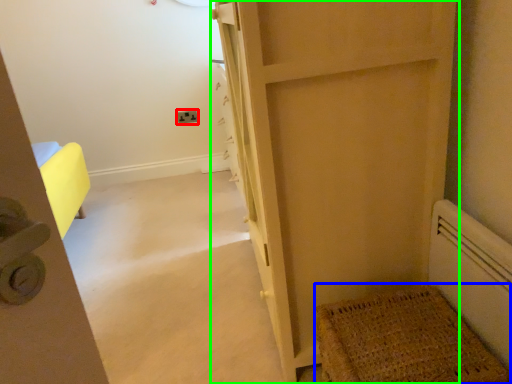
Question: Estimate the real-world distances between objects in this image. Which object is closer to electric outlet (highlighted by a red box), doormat (highlighted by a blue box) or door (highlighted by a green box)?

Choices:
 (A) doormat
 (B) door

Answer: (B)